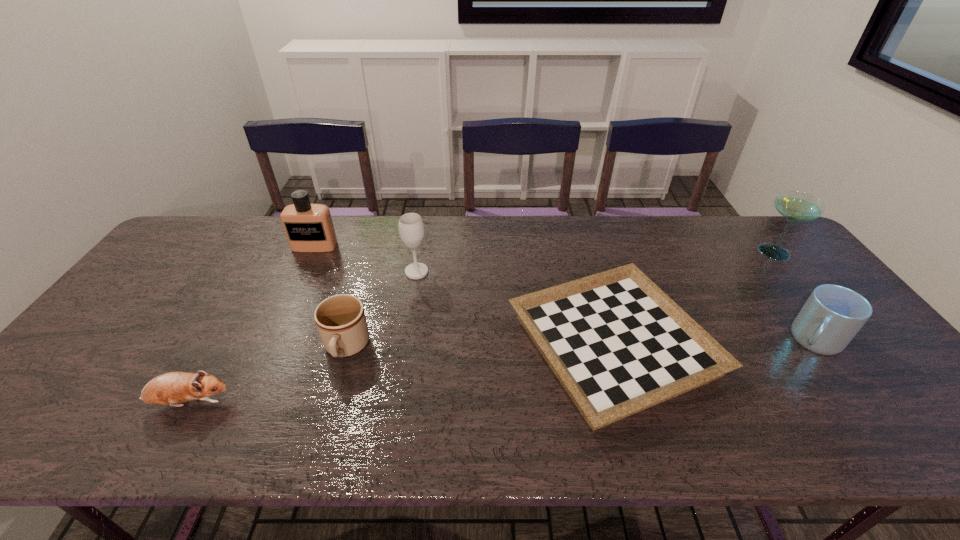
Where is `blank region between the wineglass and the third shortest object`? The width and height of the screenshot is (960, 540). blank region between the wineglass and the third shortest object is located at coordinates (381, 310).

Identify the location of vacant region between the second shortest object and the fourth object from right to left. The height and width of the screenshot is (540, 960). tap(303, 338).

Select which object is the fifth closest to the right mug. Please provide its 2D coordinates. Your answer should be formatted as a tuple, i.e. [(x, y)], where the tuple contains the x and y coordinates of a point satisfying the conditions above.

[(309, 228)]

Where is `object that ranks as the third closest to the perfume`? object that ranks as the third closest to the perfume is located at coordinates (171, 388).